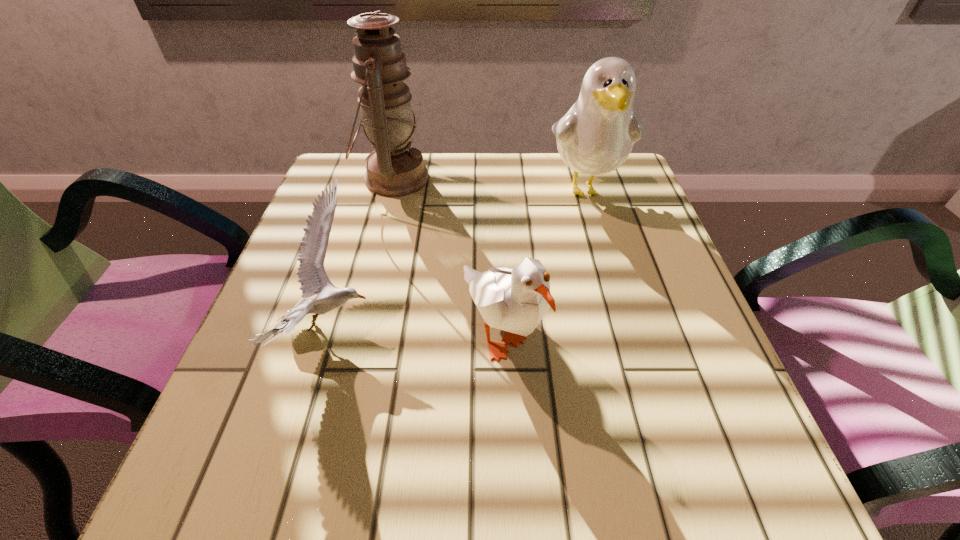
Locate an element on the screen. The width and height of the screenshot is (960, 540). vacant space positioned 0.220m at the tip of the beak of the shortest gull is located at coordinates (502, 327).

You are a GUI agent. You are given a task and a screenshot of the screen. Output one action in this format:
    pyautogui.click(x=<x>, y=<y>)
    Task: Click on the oil lamp that is at the far edge
    The width and height of the screenshot is (960, 540).
    Given the screenshot: What is the action you would take?
    pyautogui.click(x=394, y=169)

Image resolution: width=960 pixels, height=540 pixels. What are the coordinates of `gull positioned at the far edge` in the screenshot? It's located at (595, 137).

Locate an element on the screen. This screenshot has height=540, width=960. oil lamp that is at the left edge is located at coordinates (394, 169).

Identify the location of gull that is at the left edge. (312, 277).

Identify the location of object located at the right edge. (595, 137).

The image size is (960, 540). What are the coordinates of `object that is at the far left corner` in the screenshot? It's located at click(x=394, y=169).

Identify the location of object that is at the far right corner. (595, 137).

In the image, there is a desktop. Where is `vacant space at the far edge`? vacant space at the far edge is located at coordinates (538, 187).

In the image, there is a desktop. Where is `vacant space at the near edge`? The height and width of the screenshot is (540, 960). vacant space at the near edge is located at coordinates (602, 506).